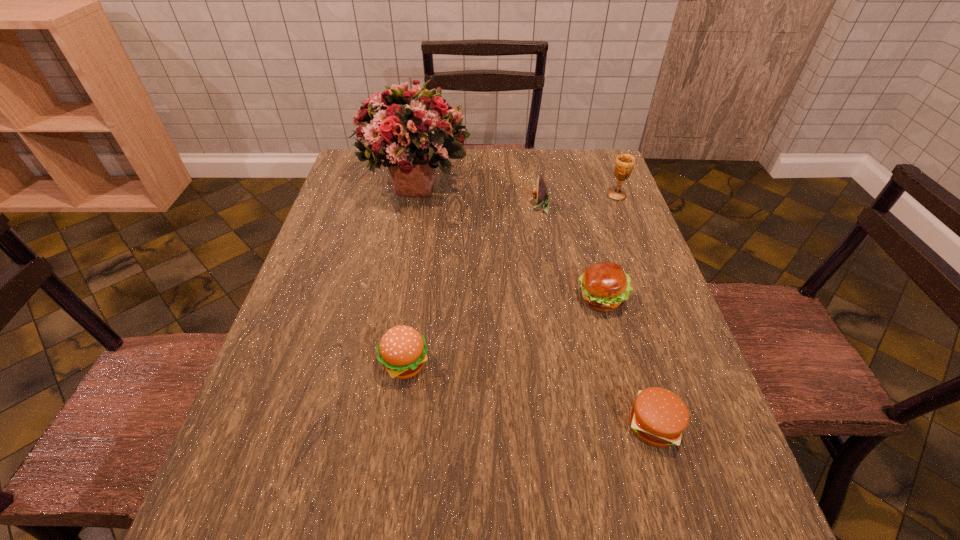
What are the coordinates of `object positioned at the far left corner` in the screenshot? It's located at (414, 132).

The width and height of the screenshot is (960, 540). Identify the location of vacant space at the far edge of the desktop. (548, 162).

I want to click on free space at the left edge, so click(x=356, y=320).

Identify the location of free space at the right edge of the desktop. The image size is (960, 540). (657, 467).

Where is `free spot at the far left corner of the desktop`? free spot at the far left corner of the desktop is located at coordinates [369, 187].

The width and height of the screenshot is (960, 540). Identify the location of free space at the far right corner. (606, 165).

You are a GUI agent. You are given a task and a screenshot of the screen. Output one action in this format:
    pyautogui.click(x=<x>, y=<y>)
    Task: Click on the vacant point at the near right corner
    
    Given the screenshot: What is the action you would take?
    pyautogui.click(x=695, y=519)

Where is `free space between the third object from left to right and the farthest hamburger`? free space between the third object from left to right and the farthest hamburger is located at coordinates (570, 253).

At what (x,y) coordinates should I click in order to perform the action: click on vacant space that is in between the avocado and the third nearest object. Please return your answer as a coordinate pair (x, y). Looking at the image, I should click on (570, 253).

Locate an element on the screen. vacant space in between the shortest object and the bouquet is located at coordinates (535, 304).